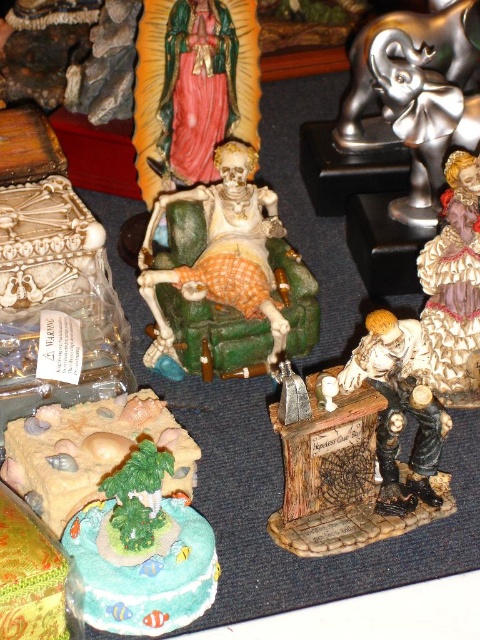
Question: Considering the real-world distances, which object is farthest from the shiny silver elephant at upper right?

Choices:
 (A) matte plastic island at lower left
 (B) matte porcelain figure at lower right
 (C) gold textured figurine at center-right

Answer: (A)

Question: Is matte plastic skeleton at center bigger than gold textured figurine at center-right?

Choices:
 (A) yes
 (B) no

Answer: (A)

Question: From the image, what is the correct spatial relationship of matte plastic skeleton at center in relation to shiny silver elephant at upper right?

Choices:
 (A) left
 (B) right

Answer: (A)

Question: Considering the relative positions of shiny silver elephant at upper right and matte porcelain figure at lower right in the image provided, where is shiny silver elephant at upper right located with respect to matte porcelain figure at lower right?

Choices:
 (A) below
 (B) above

Answer: (B)

Question: Estimate the real-world distances between objects in this image. Which object is closer to the matte plastic island at lower left?

Choices:
 (A) gold textured figurine at center-right
 (B) shiny silver elephant at upper right
 (C) matte porcelain figure at lower right

Answer: (C)

Question: Which object is closer to the camera taking this photo?

Choices:
 (A) shiny silver elephant at upper right
 (B) matte plastic island at lower left

Answer: (B)